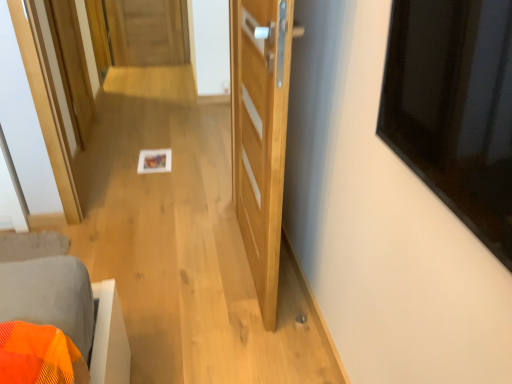
Image resolution: width=512 pixels, height=384 pixels. In order to click on free region under natural wood door at center (from a real-world perspective) in this screenshot , I will do `click(243, 267)`.